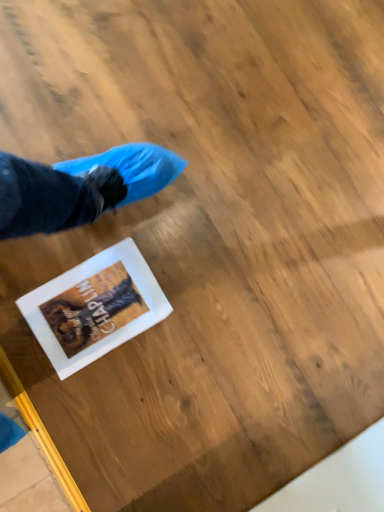
Question: Should I look upward or downward to see white glossy postcard at lower center?

Choices:
 (A) down
 (B) up

Answer: (A)